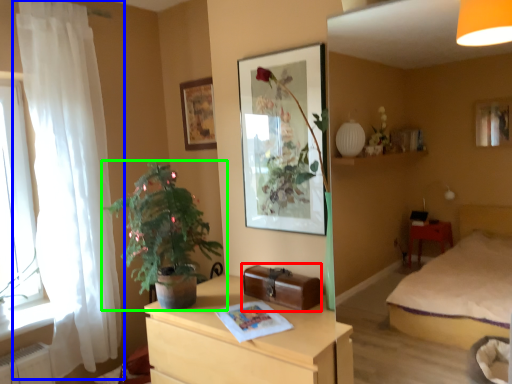
Question: Which object is the farthest from luggage (highlighted by a red box)? Choose among these: curtain (highlighted by a blue box) or houseplant (highlighted by a green box).

Choices:
 (A) curtain
 (B) houseplant

Answer: (A)